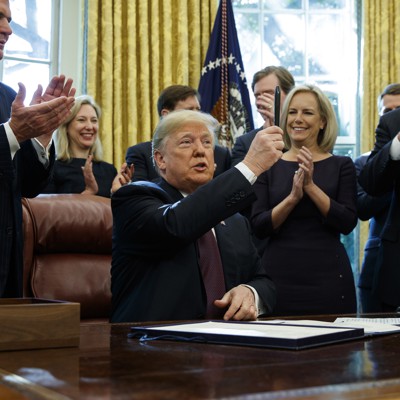
Image resolution: width=400 pixels, height=400 pixels. In order to click on wooden desktop in this screenshot , I will do `click(250, 373)`.